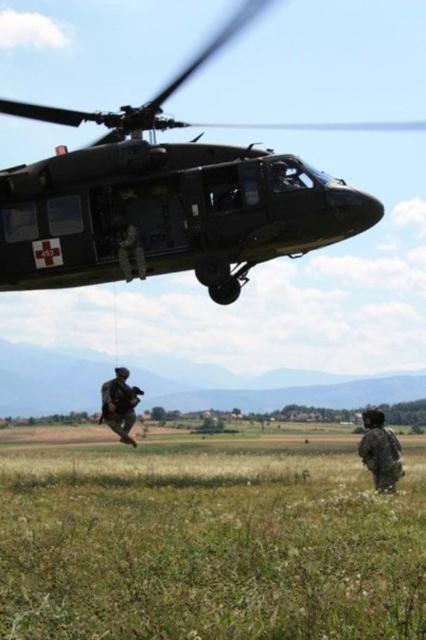
Question: Which object is farther from the camera taking this photo?

Choices:
 (A) matte black helicopter at upper center
 (B) camouflage uniform at center

Answer: (A)

Question: Is camouflage uniform at lower right above camouflage uniform at center?

Choices:
 (A) yes
 (B) no

Answer: (B)

Question: Is matte black helicopter at upper center thinner than camouflage uniform at center?

Choices:
 (A) no
 (B) yes

Answer: (B)

Question: Which point is closer to the camera?

Choices:
 (A) (118, 385)
 (B) (123, 176)
 (C) (383, 444)

Answer: (B)

Question: Observing the image, what is the correct spatial positioning of camouflage uniform at lower right in reference to camouflage uniform at center?

Choices:
 (A) left
 (B) right

Answer: (B)

Question: Which object is positioned farthest from the camouflage uniform at center?

Choices:
 (A) camouflage uniform at lower right
 (B) matte black helicopter at upper center

Answer: (B)